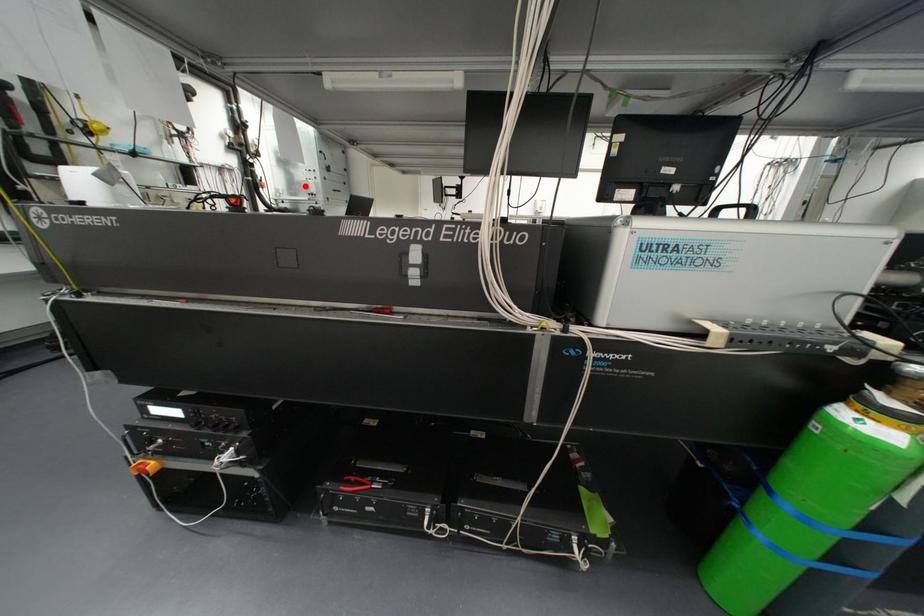
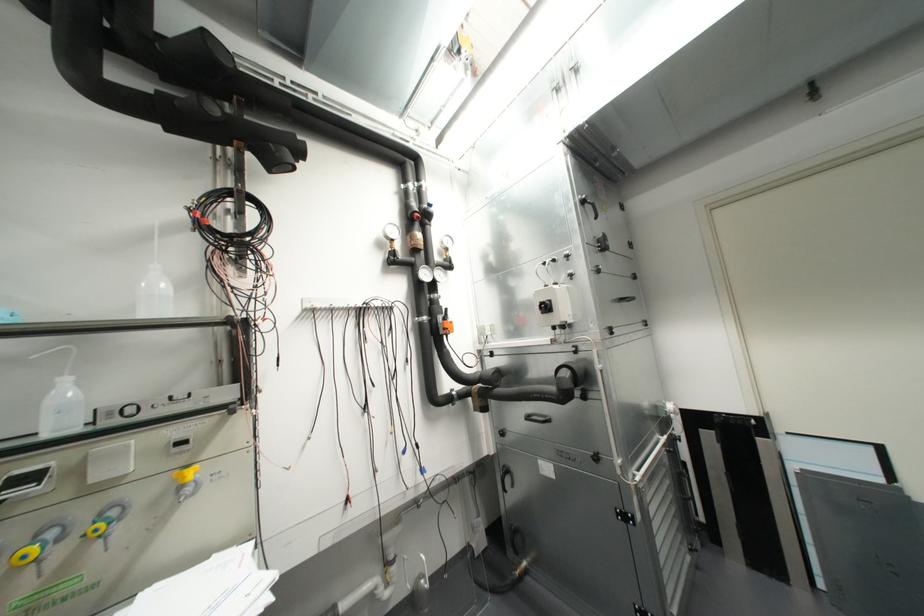
Question: I am providing you with two images of the same scene from different viewpoints. Image1 has a red point marked. In image2, the corresponding 3D location appears at what relative position? Reply with the corresponding letter.

Choices:
 (A) Closer
 (B) Farther

Answer: (B)